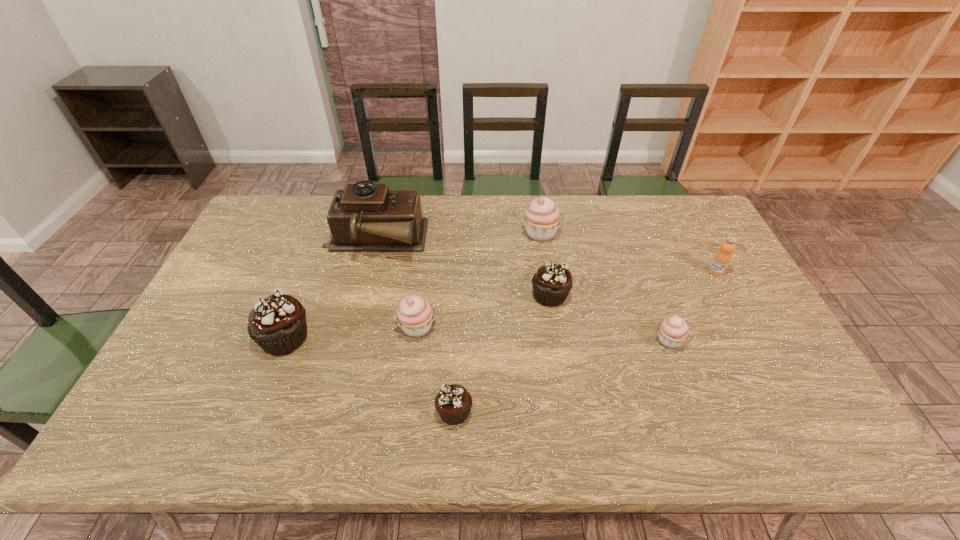
Choose which cupcake is the fifth nearest neighbor to the second biggest pink cupcake. Please provide its 2D coordinates. Your answer should be formatted as a tuple, i.e. [(x, y)], where the tuple contains the x and y coordinates of a point satisfying the conditions above.

[(673, 331)]

What are the coordinates of `cupcake that is the fifth closest to the farthest pink cupcake` in the screenshot? It's located at (277, 323).

Select which pink cupcake appears as the third closest to the phonograph_record. Please provide its 2D coordinates. Your answer should be formatted as a tuple, i.e. [(x, y)], where the tuple contains the x and y coordinates of a point satisfying the conditions above.

[(673, 331)]

Choose which pink cupcake is the nearest neighbor to the smallest pink cupcake. Please provide its 2D coordinates. Your answer should be formatted as a tuple, i.e. [(x, y)], where the tuple contains the x and y coordinates of a point satisfying the conditions above.

[(542, 217)]

Locate which brown cupcake ranks second in proximity to the phonograph_record. Please provide its 2D coordinates. Your answer should be formatted as a tuple, i.e. [(x, y)], where the tuple contains the x and y coordinates of a point satisfying the conditions above.

[(552, 283)]

Identify the location of brown cupcake that is the closest to the second smallest pink cupcake. This screenshot has height=540, width=960. (453, 403).